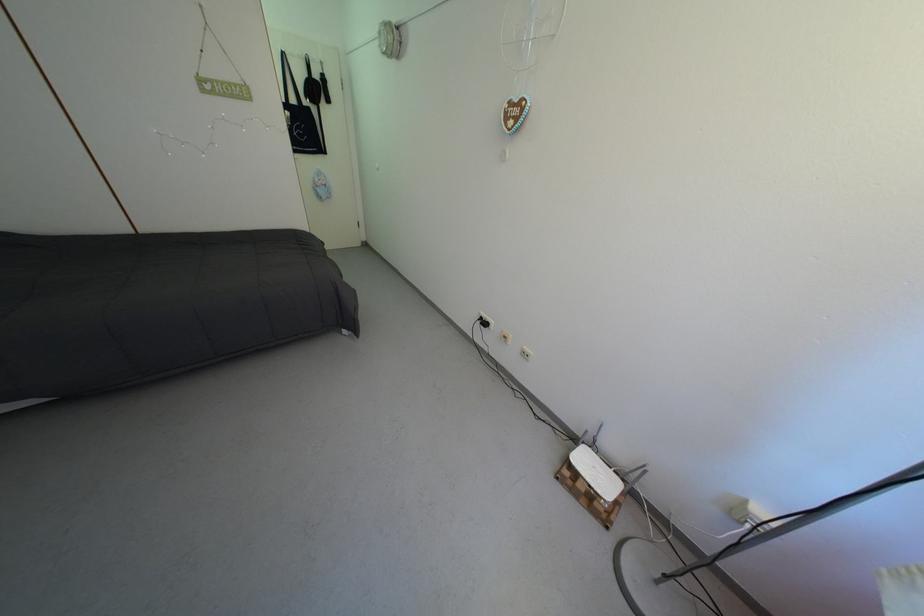
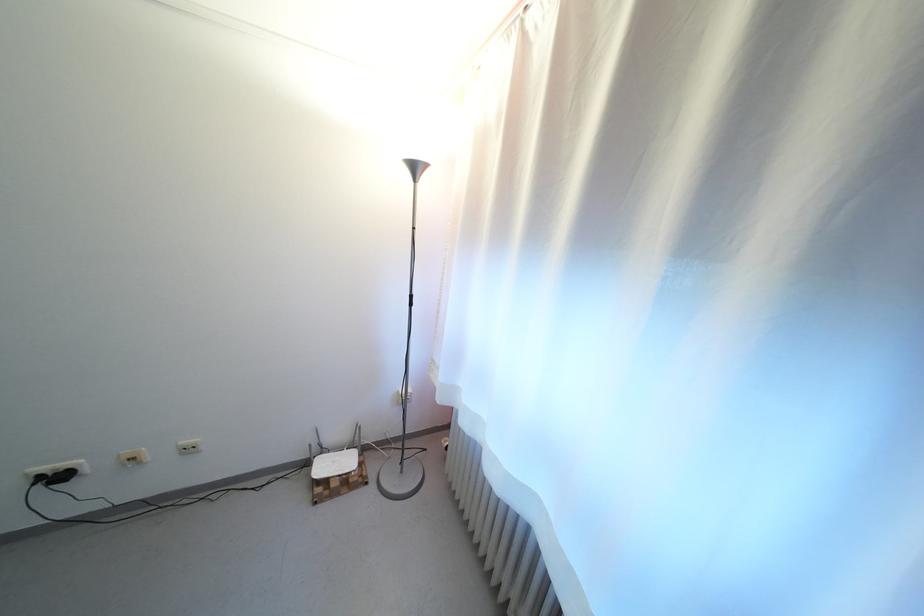
Find the pixel in the second image that matches point (602, 452) in the first image.

(332, 456)